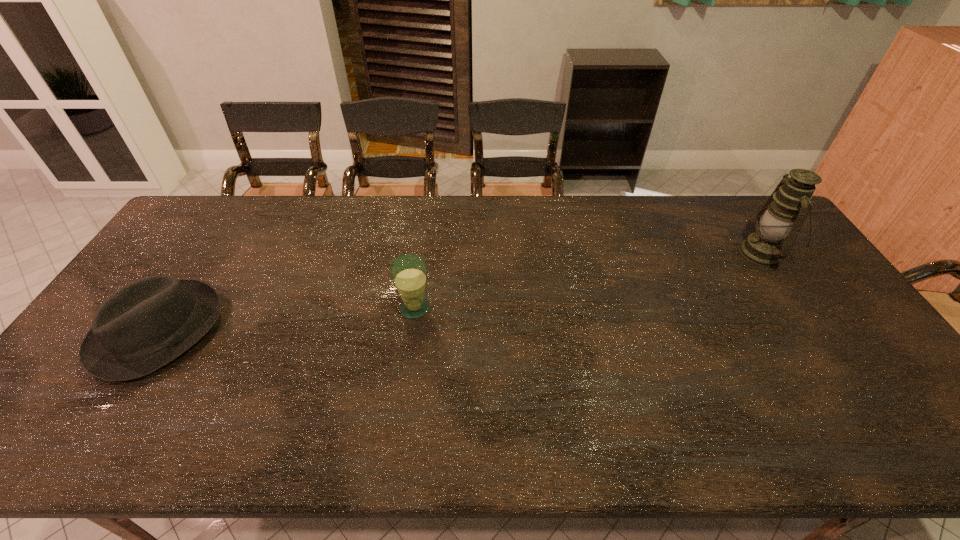
You are a GUI agent. You are given a task and a screenshot of the screen. Output one action in this format:
    pyautogui.click(x=<x>, y=<y>)
    Task: Click on the object that is at the left edge
    
    Given the screenshot: What is the action you would take?
    pyautogui.click(x=141, y=327)

At what (x,y) coordinates should I click in order to perform the action: click on object present at the right edge. Please return your answer as a coordinate pair (x, y). This screenshot has height=540, width=960. Looking at the image, I should click on (783, 214).

This screenshot has width=960, height=540. I want to click on object present at the far right corner, so click(783, 214).

At what (x,y) coordinates should I click in order to perform the action: click on free space at the far edge. Please return your answer as a coordinate pair (x, y). The height and width of the screenshot is (540, 960). Looking at the image, I should click on (358, 201).

Identify the location of free space at the near edge. The width and height of the screenshot is (960, 540). (703, 449).

Locate an element on the screen. The image size is (960, 540). vacant space at the left edge of the desktop is located at coordinates (183, 241).

Identify the location of vacant area at the far left corner. (222, 220).

The height and width of the screenshot is (540, 960). In order to click on vacant space that is in between the fedora and the farthest object in this screenshot , I will do `click(461, 292)`.

Where is `free spot between the second tallest object and the fedora`? free spot between the second tallest object and the fedora is located at coordinates (287, 320).

You are a GUI agent. You are given a task and a screenshot of the screen. Output one action in this format:
    pyautogui.click(x=<x>, y=<y>)
    Task: Click on the vacant region between the fedora and the oil lamp
    
    Given the screenshot: What is the action you would take?
    pyautogui.click(x=461, y=292)